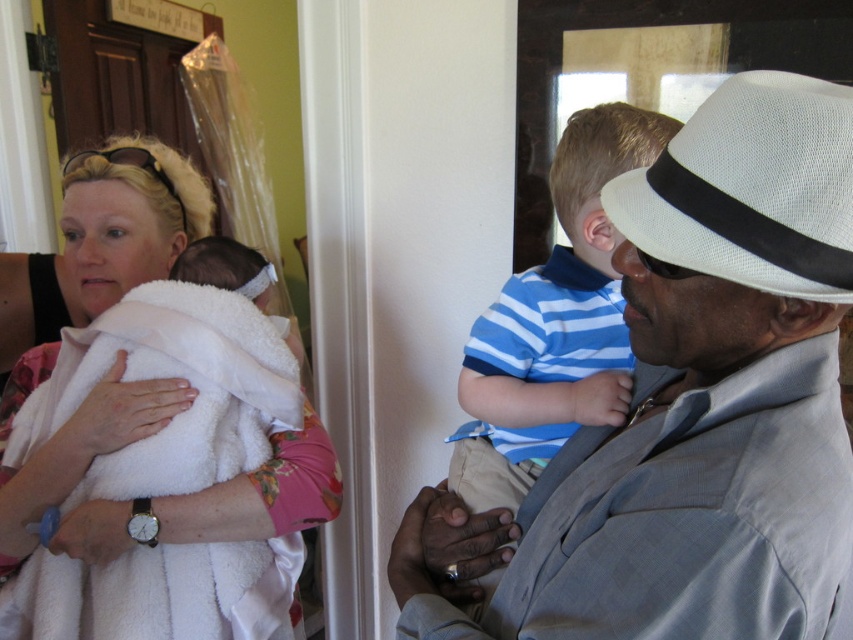
Who is more distant from viewer, (822, 124) or (192, 198)?

Point (192, 198)

Between light gray checkered suit at center and white fluffy towel at left, which one is positioned higher?

white fluffy towel at left

Does point (842, 228) lie in front of point (6, 433)?

That is True.

Locate an element on the screen. The image size is (853, 640). light gray checkered suit at center is located at coordinates (x=692, y=404).

Is white fluffy towel at left closer to camera compared to white fabric hat at right?

No, white fluffy towel at left is further to the viewer.

Where is `white fluffy towel at left`? Image resolution: width=853 pixels, height=640 pixels. white fluffy towel at left is located at coordinates (126, 218).

What do you see at coordinates (126, 218) in the screenshot?
I see `white fluffy towel at left` at bounding box center [126, 218].

Find the location of a particular element. The image size is (853, 640). white fluffy towel at left is located at coordinates (126, 218).

Who is positioned more to the right, light gray checkered suit at center or white fabric hat at right?

From the viewer's perspective, white fabric hat at right appears more on the right side.

In the scene shown: Between light gray checkered suit at center and white fabric hat at right, which one appears on the left side from the viewer's perspective?

From the viewer's perspective, light gray checkered suit at center appears more on the left side.

You are a GUI agent. You are given a task and a screenshot of the screen. Output one action in this format:
    pyautogui.click(x=<x>, y=<y>)
    Task: Click on the light gray checkered suit at center
    
    Given the screenshot: What is the action you would take?
    pyautogui.click(x=692, y=404)